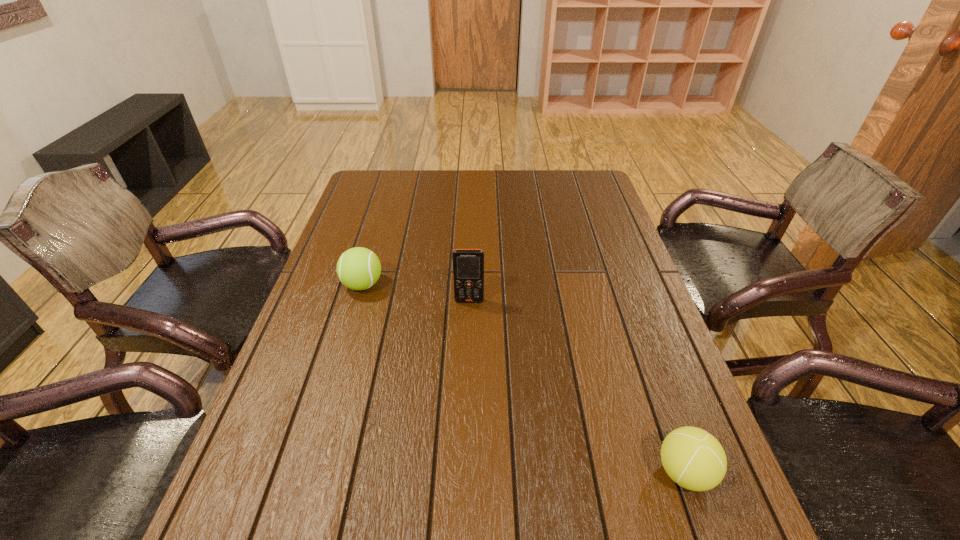
This screenshot has height=540, width=960. Identify the location of the tallest object. (468, 264).

Where is `the second object from right to left`? This screenshot has height=540, width=960. the second object from right to left is located at coordinates (468, 264).

Locate an element on the screen. The width and height of the screenshot is (960, 540). the farther tennis ball is located at coordinates (358, 268).

You are a GUI agent. You are given a task and a screenshot of the screen. Output one action in this format:
    pyautogui.click(x=<x>, y=<y>)
    Task: Click on the leftmost object
    This screenshot has width=960, height=540.
    Given the screenshot: What is the action you would take?
    pyautogui.click(x=358, y=268)

In order to click on the right tennis ball in this screenshot , I will do `click(694, 459)`.

Where is `the nearest object`? Image resolution: width=960 pixels, height=540 pixels. the nearest object is located at coordinates (694, 459).

You are a GUI agent. You are given a task and a screenshot of the screen. Output one action in this format:
    pyautogui.click(x=<x>, y=<y>)
    Task: Click on the vacant space located on the screen of the tallest object
    This screenshot has height=540, width=960.
    Given the screenshot: What is the action you would take?
    pyautogui.click(x=466, y=432)

The height and width of the screenshot is (540, 960). Find the location of `vacant space located on the back of the left tennis ball`. vacant space located on the back of the left tennis ball is located at coordinates (386, 206).

In order to click on vacant point located 0.080m on the left of the right tennis ball in this screenshot , I will do `click(613, 472)`.

Where is `object located in the left edge section of the desktop`? object located in the left edge section of the desktop is located at coordinates (358, 268).